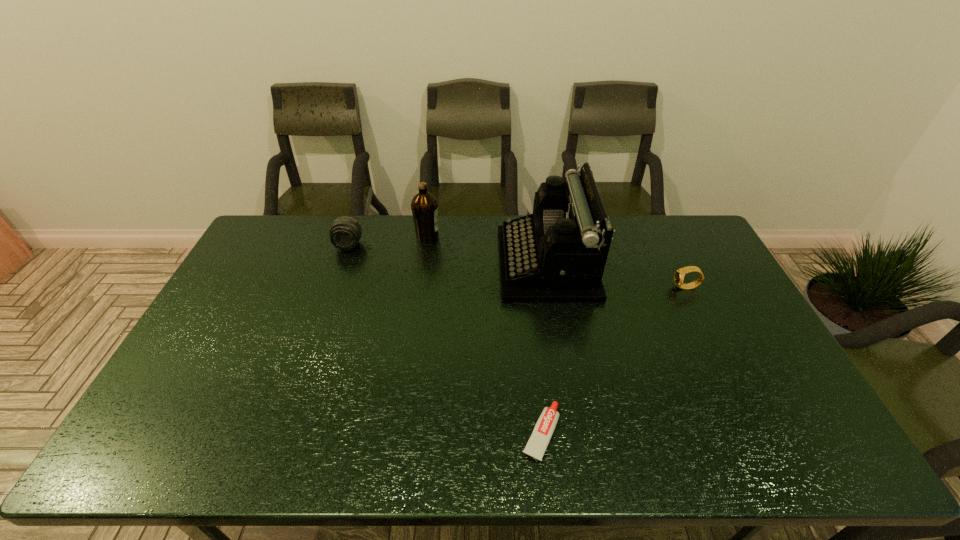
Identify the location of typewriter. The height and width of the screenshot is (540, 960). (557, 254).

Where is `the second object from left to right`? This screenshot has height=540, width=960. the second object from left to right is located at coordinates click(424, 206).

Locate an element on the screen. olive oil is located at coordinates (424, 206).

Locate an element on the screen. The height and width of the screenshot is (540, 960). the leftmost object is located at coordinates (345, 233).

Where is `the third shortest object`? The width and height of the screenshot is (960, 540). the third shortest object is located at coordinates (345, 233).

Identify the location of the rightmost object. (679, 275).

This screenshot has width=960, height=540. I want to click on the second shortest object, so click(679, 275).

Identify the location of the shortest object. The width and height of the screenshot is (960, 540). [536, 446].

You are a GUI agent. You are given a task and a screenshot of the screen. Output one action in this format:
    pyautogui.click(x=<x>, y=<y>)
    Task: Click on the nearest object
    The height and width of the screenshot is (540, 960).
    Given the screenshot: What is the action you would take?
    pyautogui.click(x=536, y=446)

I want to click on vacant space located on the typing side of the typewriter, so click(419, 264).